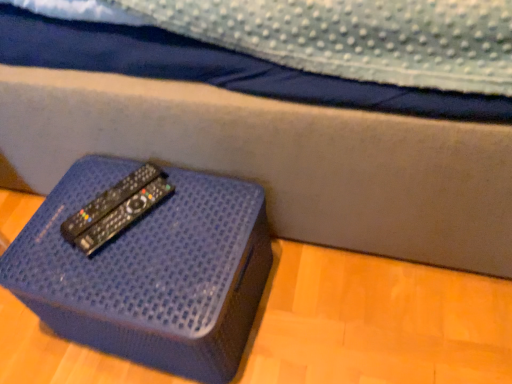
The height and width of the screenshot is (384, 512). What are the coordinates of `free space above blue textured box at lower left (from a real-world perspective)` in the screenshot? It's located at (123, 230).